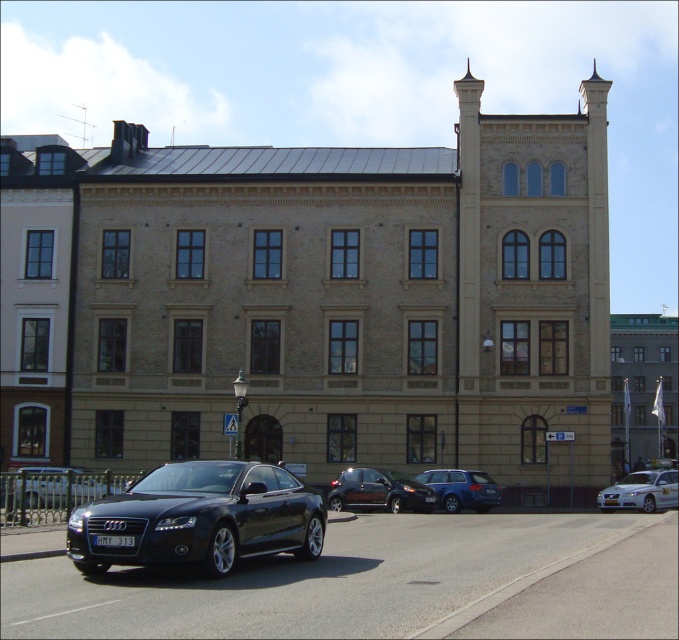
Is glossy black car at center positioned in front of silver metallic sedan at lower right?

Yes, glossy black car at center is closer to the viewer.

Can you confirm if glossy black car at center is bigger than silver metallic sedan at lower right?

Actually, glossy black car at center might be smaller than silver metallic sedan at lower right.

The image size is (679, 640). Describe the element at coordinates (198, 518) in the screenshot. I see `glossy black car at center` at that location.

I want to click on glossy black car at center, so click(x=198, y=518).

Between point (221, 472) and point (43, 506), which one is positioned behind?

Positioned behind is point (43, 506).

Who is shorter, glossy black car at center or shiny black sedan at lower left?

glossy black car at center is shorter.

The image size is (679, 640). Find the location of `glossy black car at center`. glossy black car at center is located at coordinates (198, 518).

Does satin black suv at center have a smaller size compared to satin blue station wagon at center?

Correct, satin black suv at center occupies less space than satin blue station wagon at center.

Describe the element at coordinates (380, 492) in the screenshot. The height and width of the screenshot is (640, 679). I see `satin black suv at center` at that location.

Describe the element at coordinates (380, 492) in the screenshot. I see `satin black suv at center` at that location.

I want to click on satin black suv at center, so click(380, 492).